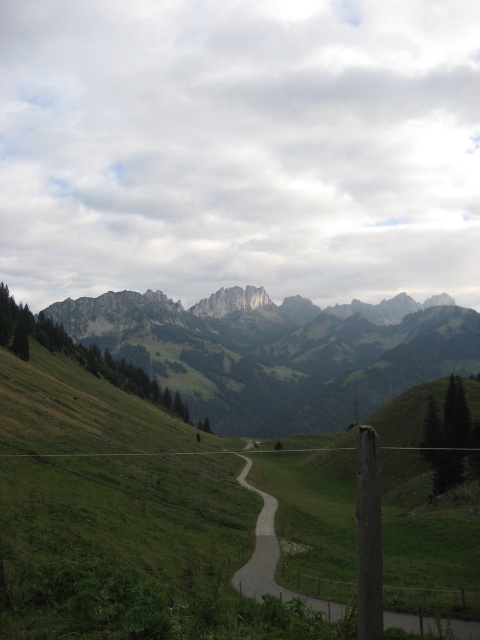
Does rugged stone mountains at upper center have a lesser width compared to gray asphalt road at center?

No, rugged stone mountains at upper center is not thinner than gray asphalt road at center.

Is point (208, 333) closer to viewer compared to point (267, 548)?

No, it is behind (267, 548).

I want to click on rugged stone mountains at upper center, so click(x=276, y=356).